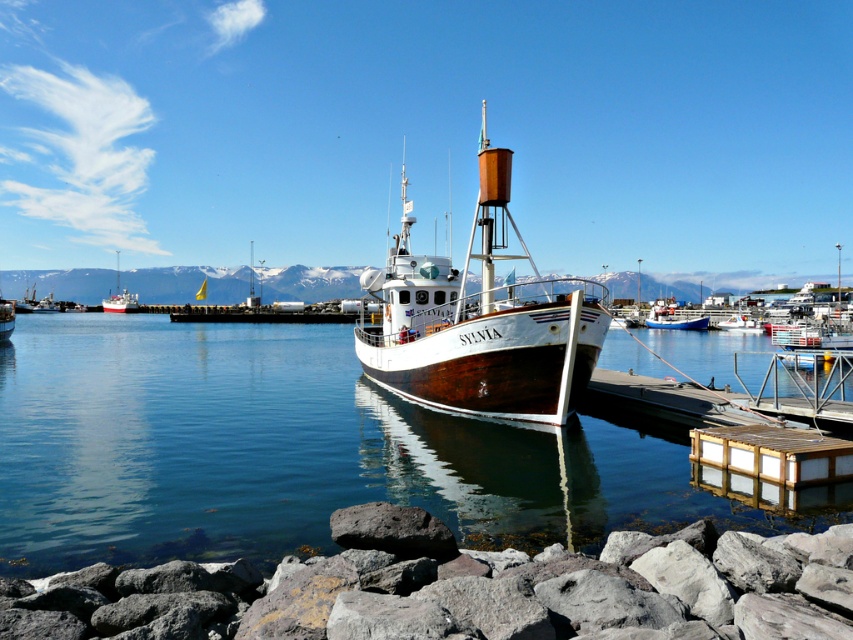
Can you confirm if white wood boat at center is wider than white glossy boat at left?

Incorrect, white wood boat at center's width does not surpass white glossy boat at left's.

Can you confirm if white wood boat at center is smaller than white glossy boat at left?

No.

Who is more distant from viewer, [480,260] or [137,294]?

The point [137,294] is more distant.

At what (x,y) coordinates should I click in order to perform the action: click on white wood boat at center. Please return your answer as a coordinate pair (x, y). The height and width of the screenshot is (640, 853). Looking at the image, I should click on (479, 321).

Is transparent water at center to the left of white wood boat at center from the viewer's perspective?

Yes, transparent water at center is to the left of white wood boat at center.

Is transparent water at center taller than white wood boat at center?

No.

Identify the location of transparent water at center. This screenshot has height=640, width=853. (294, 452).

Is transparent water at center in front of gray rock at lower left?

No, transparent water at center is behind gray rock at lower left.

Between transparent water at center and gray rock at lower left, which one appears on the left side from the viewer's perspective?

transparent water at center

Is point (263, 365) behind point (607, 541)?

Yes, point (263, 365) is farther from viewer.

I want to click on transparent water at center, so click(294, 452).